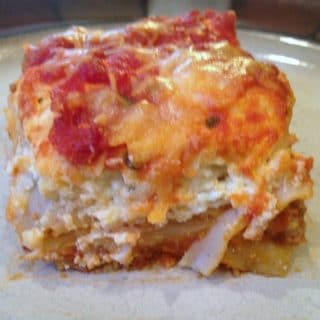
You are a GUI agent. You are given a task and a screenshot of the screen. Output one action in this format:
    pyautogui.click(x=<x>, y=<y>)
    Task: Click on the crumb
    The width and height of the screenshot is (320, 320).
    Given the screenshot: What is the action you would take?
    pyautogui.click(x=303, y=264), pyautogui.click(x=17, y=276), pyautogui.click(x=160, y=281)